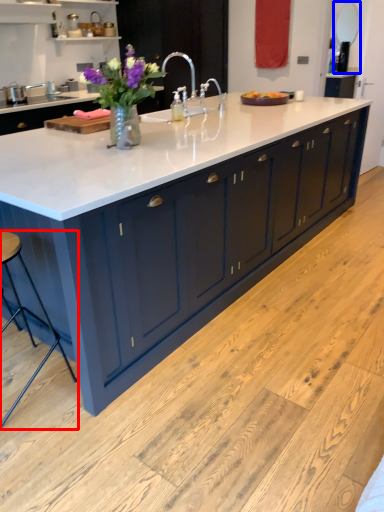
Question: Which of the following is the closest to the observer, bar stool (highlighted by a red box) or mirror (highlighted by a blue box)?

Choices:
 (A) bar stool
 (B) mirror

Answer: (A)